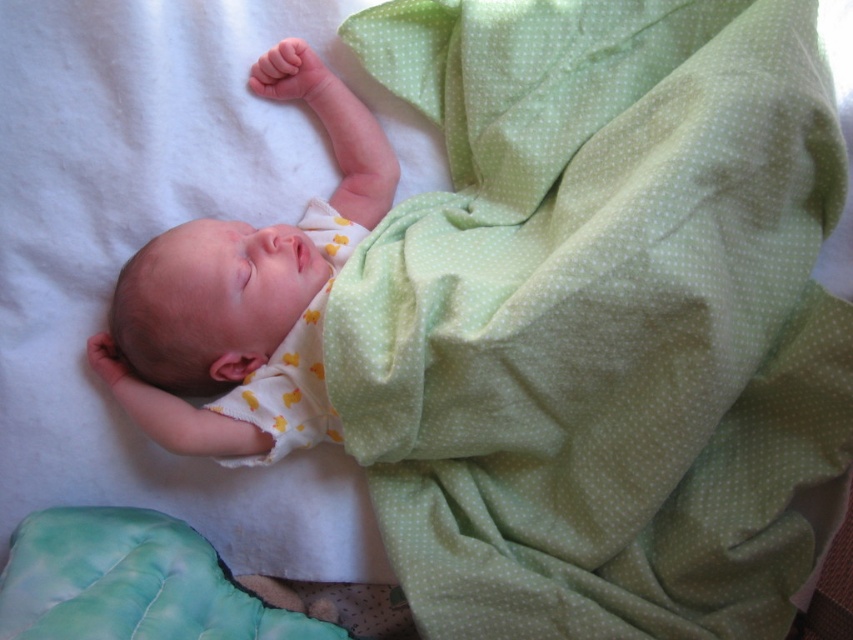
You are a photographer taking a closeup shot of the baby. You have two points marked on your viewfinder at coordinates point (387, 164) and point (335, 248). Which point is closer to your camera lens?

Point (387, 164) is further to the camera than point (335, 248), so the point closer to the camera lens is point (335, 248).

You are a parent trying to change the baby into a new onesie. The baby is currently wearing a white onesie with yellow duck motifs. You have two fabrics available to cover the baby while changing. One is the soft yellow fabric at center and the other is the yellow dotted fabric at center. Which fabric is closer to the baby to grab first?

The soft yellow fabric at center is closer to the baby since it is only 1.90 inches away from the yellow dotted fabric at center, making it easier to reach first.

Based on the photo, you are a parent trying to choose between two fabrics for a baby swaddle. You see the soft yellow fabric at center and the yellow dotted fabric at center in the image. Which fabric is located to the left when viewed from the baby?

The soft yellow fabric at center is positioned on the left side of yellow dotted fabric at center, so the soft yellow fabric at center is located to the left when viewed from the baby.